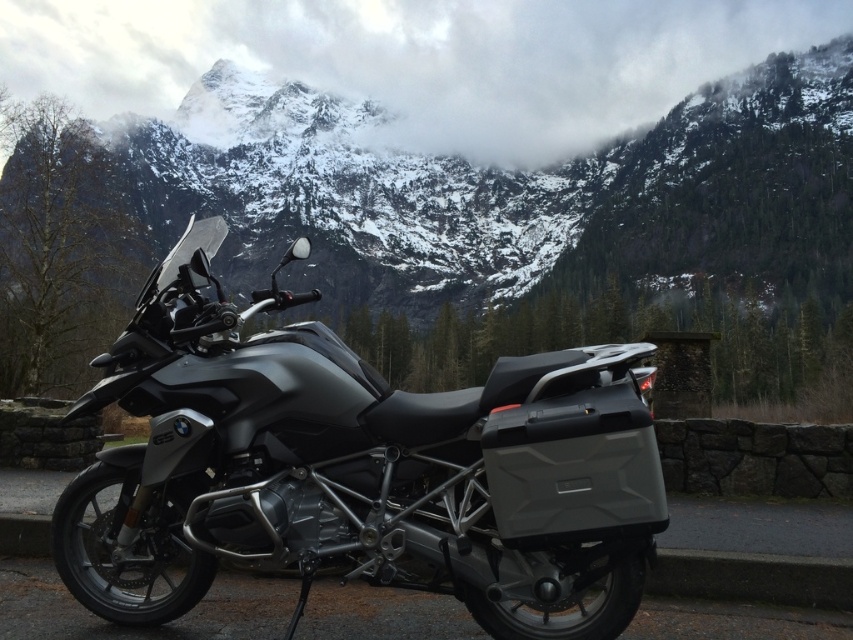
Question: Which object is farther from the camera taking this photo?

Choices:
 (A) black rubber curb at lower left
 (B) snowy granite mountain at center
 (C) matte black motorcycle at center

Answer: (B)

Question: Does matte black motorcycle at center have a smaller size compared to black rubber curb at lower left?

Choices:
 (A) yes
 (B) no

Answer: (B)

Question: Does matte black motorcycle at center have a smaller size compared to black rubber curb at lower left?

Choices:
 (A) yes
 (B) no

Answer: (B)

Question: Is snowy granite mountain at center wider than black rubber curb at lower left?

Choices:
 (A) yes
 (B) no

Answer: (A)

Question: Among these points, which one is nearest to the camera?

Choices:
 (A) (816, 595)
 (B) (235, 156)

Answer: (A)

Question: Which of the following is the closest to the observer?

Choices:
 (A) snowy granite mountain at center
 (B) matte black motorcycle at center

Answer: (B)